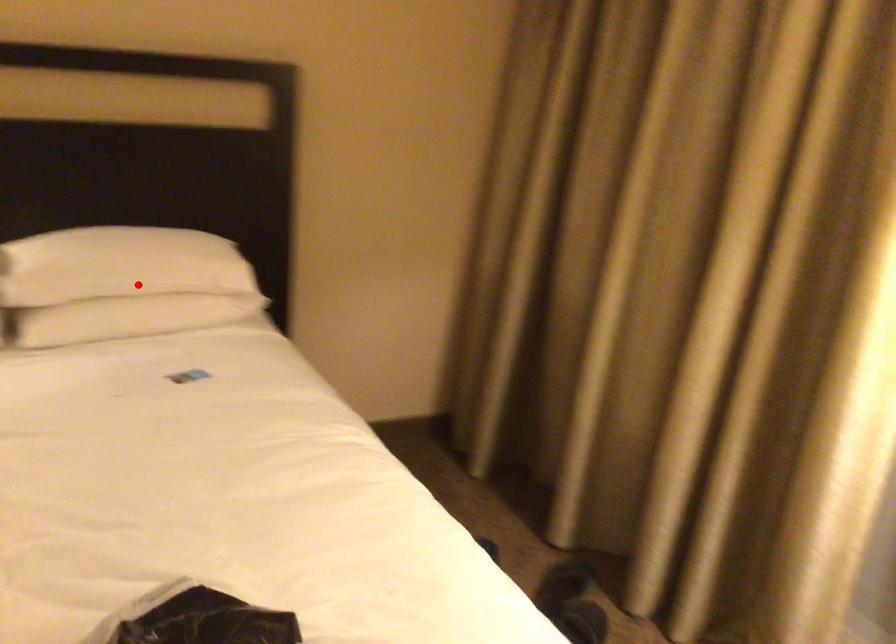
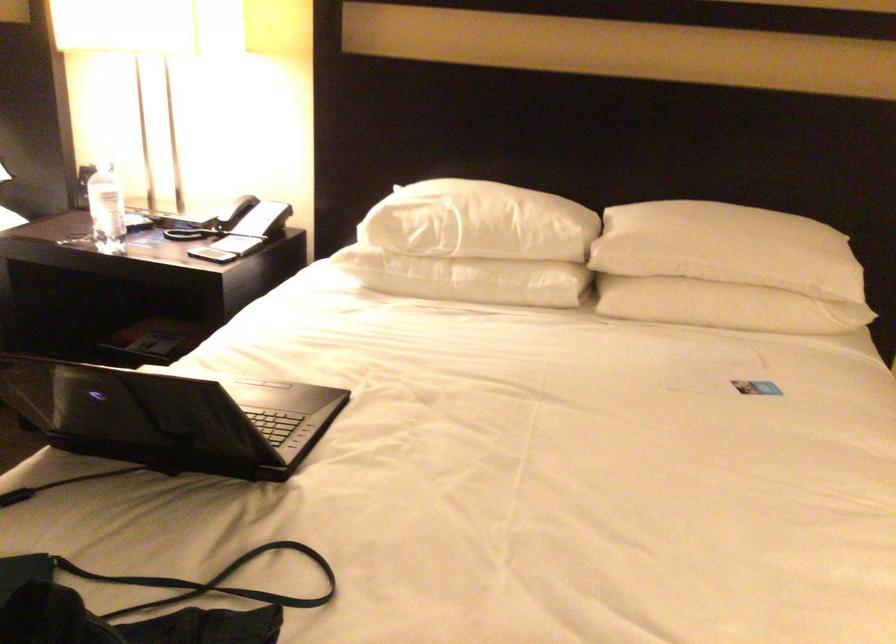
Question: I am providing you with two images of the same scene from different viewpoints. A red point is shown in image1. For the corresponding object point in image2, is it positioned nearer or farther from the camera?

Choices:
 (A) Nearer
 (B) Farther

Answer: (A)